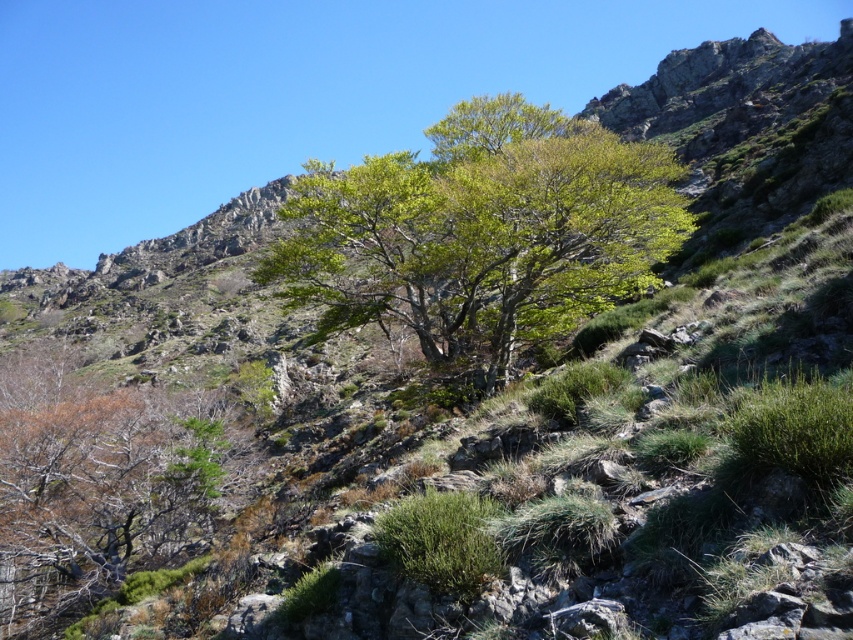
Is point (445, 168) more distant than point (3, 576)?

Yes, point (445, 168) is farther from viewer.

Can you confirm if green leafy tree at center is bigger than brown/dried wood at left?

Correct, green leafy tree at center is larger in size than brown/dried wood at left.

Identify the location of green leafy tree at center. This screenshot has width=853, height=640. (480, 234).

Locate an element on the screen. The height and width of the screenshot is (640, 853). green leafy tree at center is located at coordinates (480, 234).